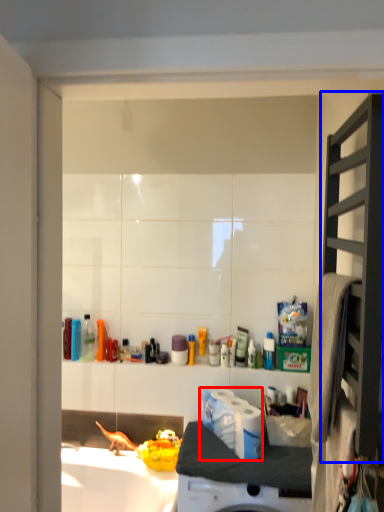
Question: Which object appears farthest to the camera in this image, toilet paper (highlighted by a red box) or shelf (highlighted by a blue box)?

Choices:
 (A) toilet paper
 (B) shelf

Answer: (A)